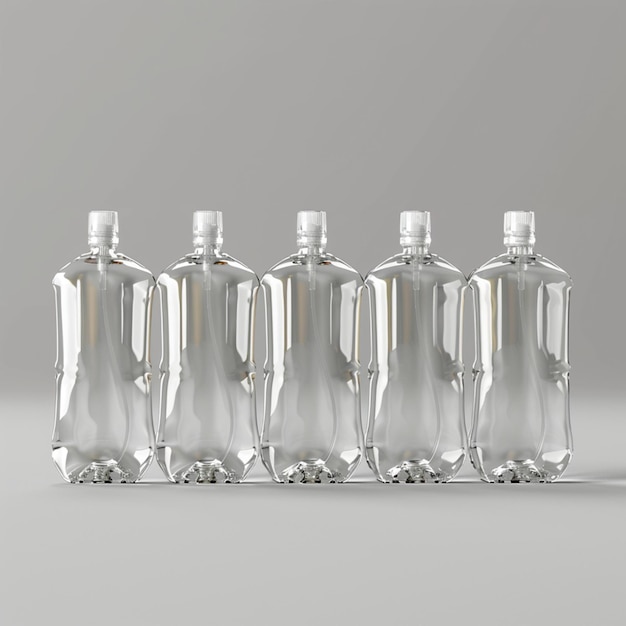
Locate an element on the screen. The height and width of the screenshot is (626, 626). bottles is located at coordinates (96, 384), (192, 377), (335, 387), (434, 398), (536, 411).